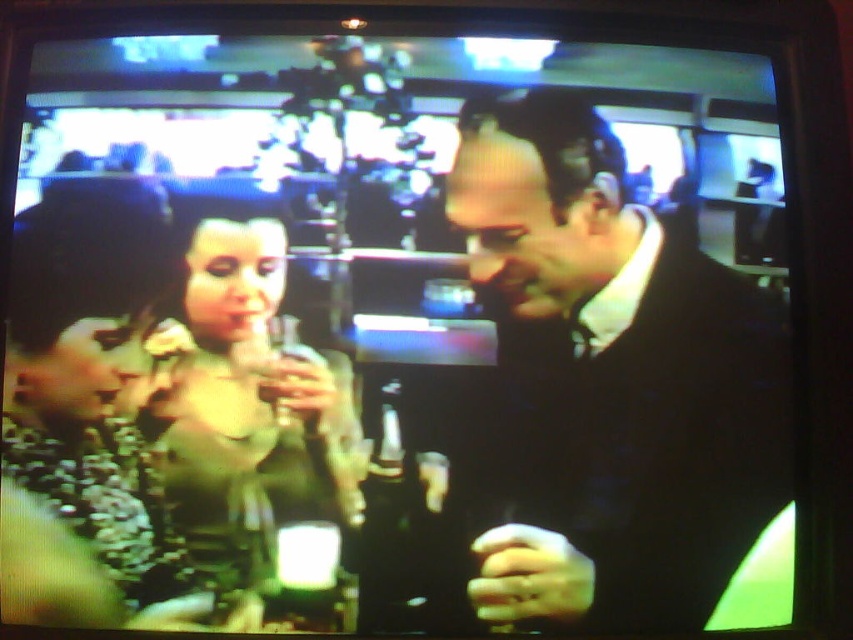
Question: Which of the following is the closest to the observer?

Choices:
 (A) (183, 512)
 (B) (775, 499)
 (C) (412, 506)

Answer: (C)

Question: Does dark wool suit at center lie in front of matte green dress at center?

Choices:
 (A) yes
 (B) no

Answer: (A)

Question: Does dark wool suit at center have a larger size compared to matte green dress at center?

Choices:
 (A) yes
 (B) no

Answer: (A)

Question: Which point is closer to the camera?

Choices:
 (A) (415, 516)
 (B) (264, 305)

Answer: (A)

Question: Is dark wool suit at center below translucent glass bottle at center?

Choices:
 (A) yes
 (B) no

Answer: (B)

Question: Among these objects, which one is nearest to the camera?

Choices:
 (A) matte green dress at center
 (B) translucent glass bottle at center
 (C) dark wool suit at center

Answer: (B)